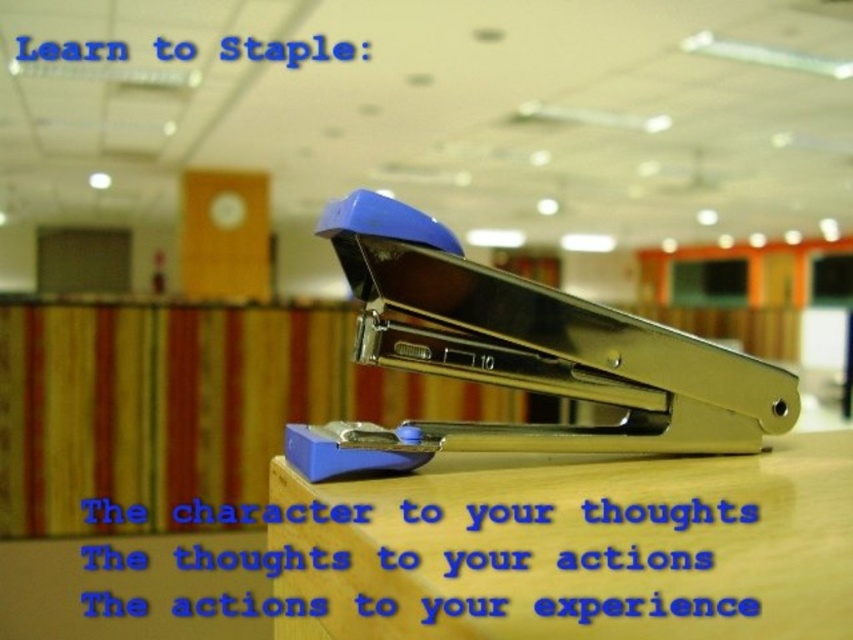
You are organizing a desk and need to place both the wooden table at center and the blue metallic stapler at center. Which object is taller and should be placed in a higher position?

The blue metallic stapler at center is taller than the wooden table at center, so it should be placed in a higher position.

You are organizing a desk and need to place a small plant between the wooden table at center and the blue metallic stapler at center. Can the plant fit between them?

The wooden table at center is larger than the blue metallic stapler at center, so there should be enough space between them to place a small plant.